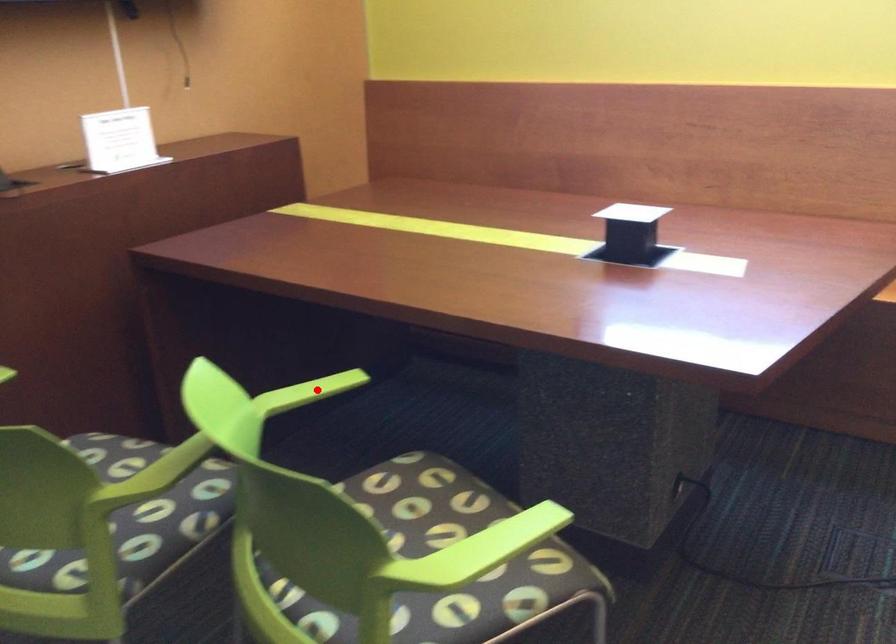
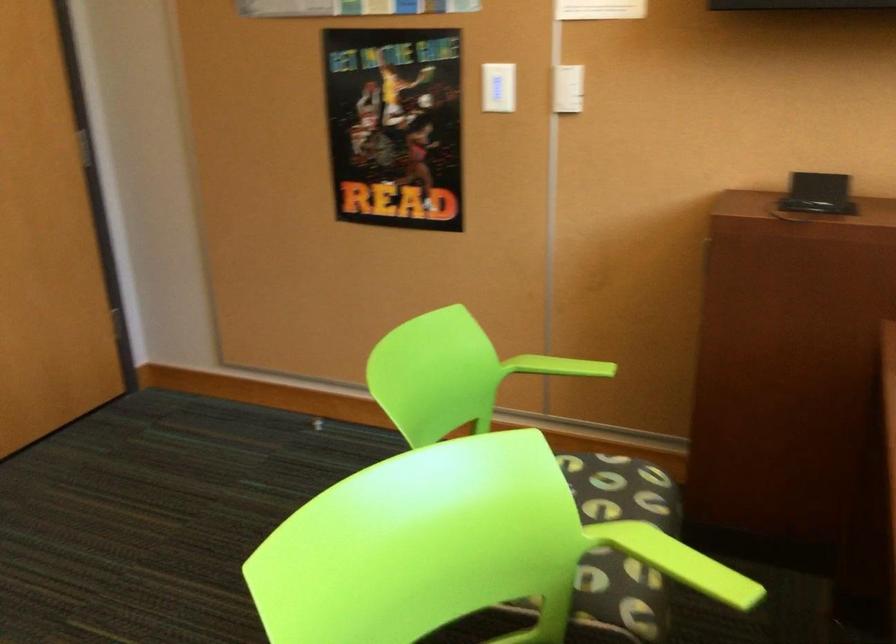
The point at the highlighted location is marked in the first image. Where is the corresponding point in the second image?

(685, 564)